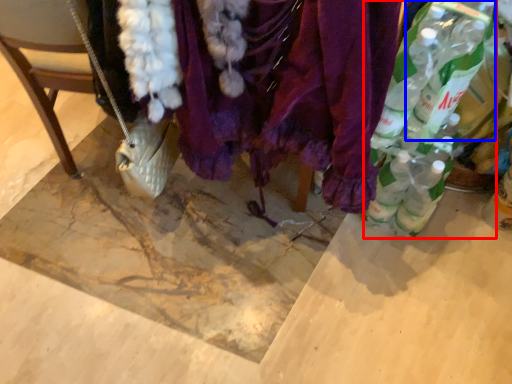
Question: Which point is further to the camera, bottle (highlighted by a red box) or bottle (highlighted by a blue box)?

Choices:
 (A) bottle
 (B) bottle

Answer: (B)